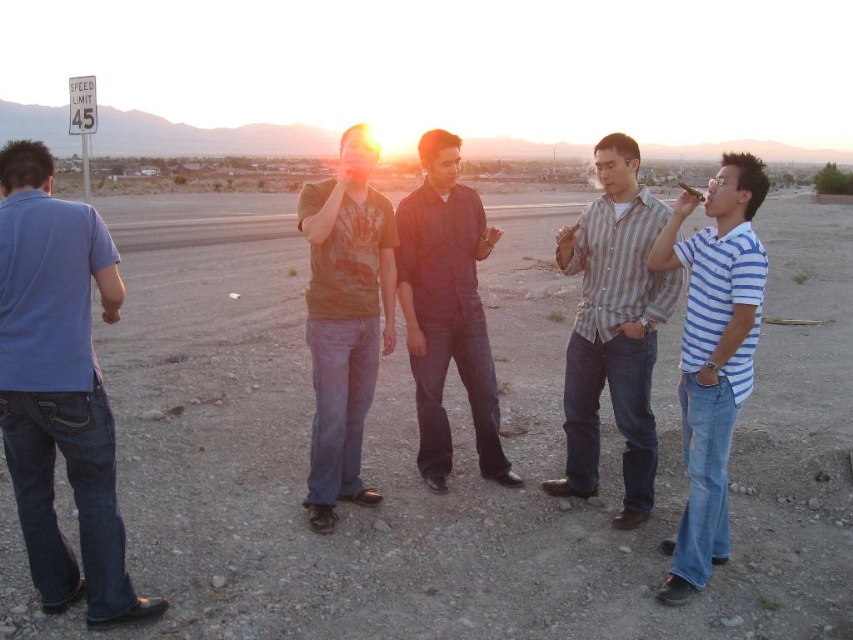
Question: From the image, what is the correct spatial relationship of matte brown t-shirt at center in relation to dark blue shirt at center?

Choices:
 (A) left
 (B) right

Answer: (A)

Question: Is striped cotton shirt at center further to the viewer compared to dark blue shirt at center?

Choices:
 (A) no
 (B) yes

Answer: (A)

Question: Which point is closer to the camera?

Choices:
 (A) (84, 540)
 (B) (634, 211)
 (C) (398, 230)

Answer: (A)

Question: Which of the following is the farthest from the observer?

Choices:
 (A) (422, 253)
 (B) (305, 186)
 (C) (728, 445)

Answer: (A)

Question: Based on their relative distances, which object is nearer to the blue striped shirt at right?

Choices:
 (A) blue cotton shirt at left
 (B) matte brown t-shirt at center
 (C) striped cotton shirt at center
 (D) dark blue shirt at center

Answer: (C)

Question: Does striped cotton shirt at center have a greater width compared to matte brown t-shirt at center?

Choices:
 (A) no
 (B) yes

Answer: (B)